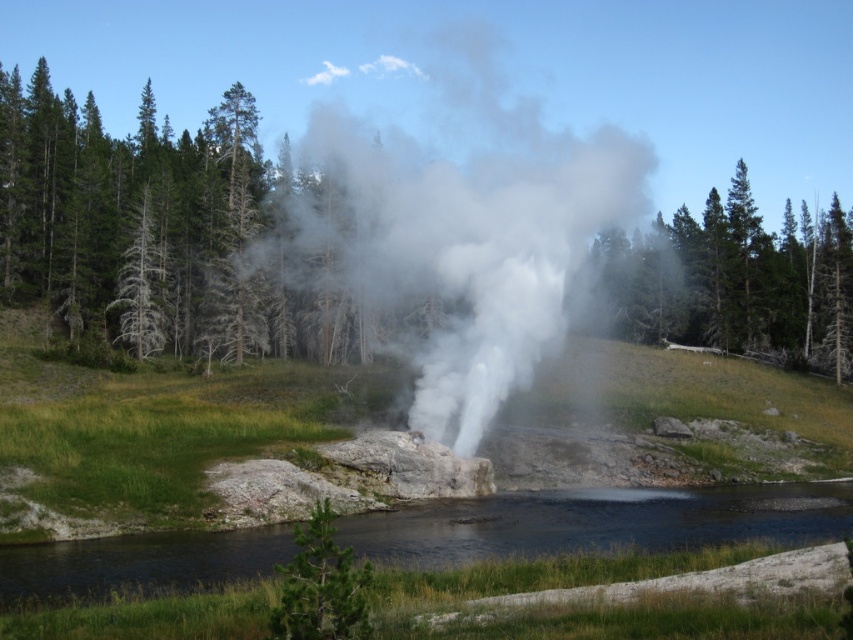
Question: Which object is positioned closest to the green matte tree at upper right?

Choices:
 (A) green textured tree at center
 (B) clear water at center
 (C) white vapor steam at center

Answer: (B)

Question: Which point is closer to the camera taking this photo?

Choices:
 (A) (744, 337)
 (B) (360, 618)

Answer: (B)

Question: Is white vapor steam at center to the right of green matte tree at upper right from the viewer's perspective?

Choices:
 (A) no
 (B) yes

Answer: (A)

Question: Is clear water at center further to the viewer compared to green textured tree at center?

Choices:
 (A) yes
 (B) no

Answer: (A)

Question: Which object is positioned closest to the green matte tree at upper right?

Choices:
 (A) green textured tree at center
 (B) clear water at center

Answer: (B)

Question: From the image, what is the correct spatial relationship of green matte tree at upper right in relation to green textured tree at center?

Choices:
 (A) below
 (B) above

Answer: (B)